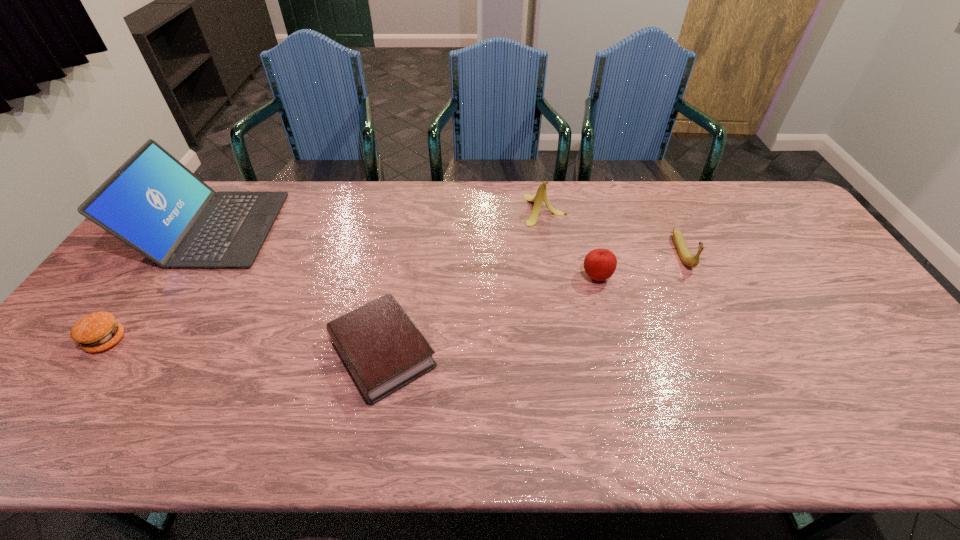
What are the coordinates of `free space located 0.360m on the left of the third object from right to left` in the screenshot? It's located at (418, 210).

In order to click on vacant space located at the stem of the rightmost object in this screenshot , I will do `click(713, 320)`.

This screenshot has width=960, height=540. Identify the location of free space located on the front of the second object from right to left. (627, 394).

Where is `vacant area situated 0.060m on the back of the patty`? This screenshot has width=960, height=540. vacant area situated 0.060m on the back of the patty is located at coordinates (130, 308).

Find the location of a particular element. The height and width of the screenshot is (540, 960). vacant region located 0.390m on the back of the Bible is located at coordinates (407, 217).

The width and height of the screenshot is (960, 540). I want to click on laptop computer at the far edge, so click(x=153, y=203).

Image resolution: width=960 pixels, height=540 pixels. I want to click on banana that is at the far edge, so click(x=541, y=195).

You are a GUI agent. You are given a task and a screenshot of the screen. Output one action in this format:
    pyautogui.click(x=<x>, y=<y>)
    Task: Click on the laptop computer located in the left edge section of the desktop
    This screenshot has width=960, height=540.
    Given the screenshot: What is the action you would take?
    pyautogui.click(x=153, y=203)

Where is `patty that is at the left edge`? The width and height of the screenshot is (960, 540). patty that is at the left edge is located at coordinates (x=98, y=331).

At what (x,y) coordinates should I click in order to perform the action: click on object at the far left corner. Please return your answer as a coordinate pair (x, y). The image size is (960, 540). Looking at the image, I should click on (153, 203).